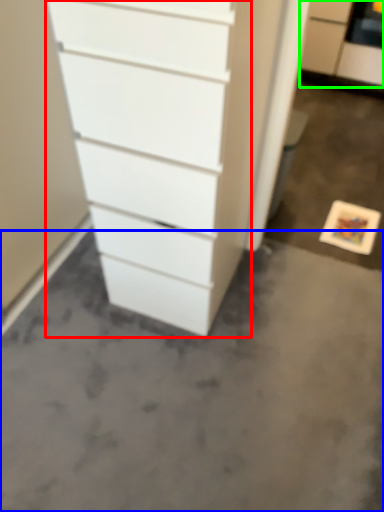
Question: Based on their relative distances, which object is farther from chest of drawers (highlighted by a red box)? Choose from concrete (highlighted by a blue box) and filing cabinet (highlighted by a green box).

Choices:
 (A) concrete
 (B) filing cabinet

Answer: (B)